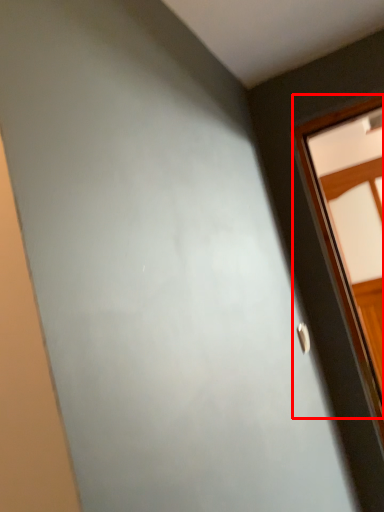
Question: From the image's perspective, what is the correct spatial relationship of window (annotated by the red box) in relation to door handle?

Choices:
 (A) below
 (B) above

Answer: (B)